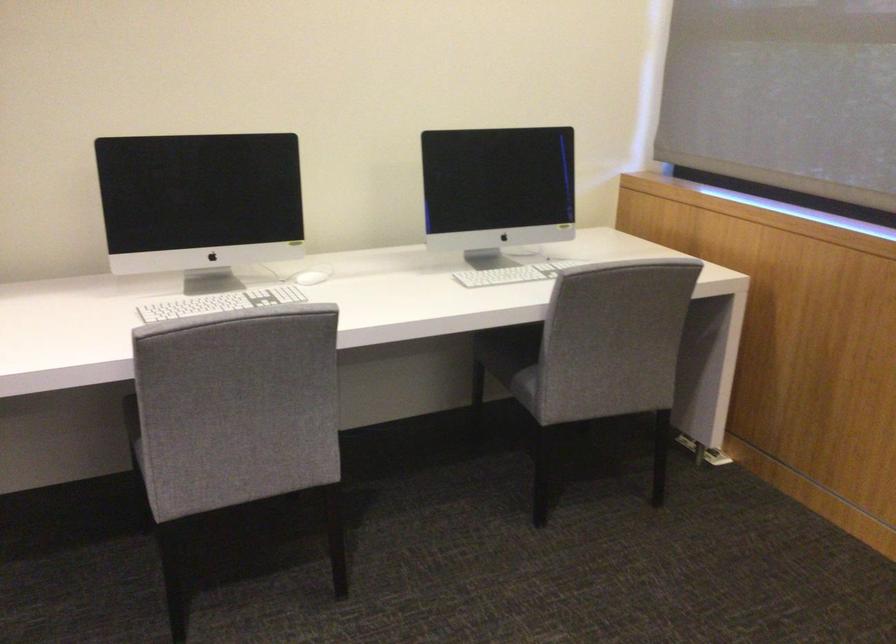
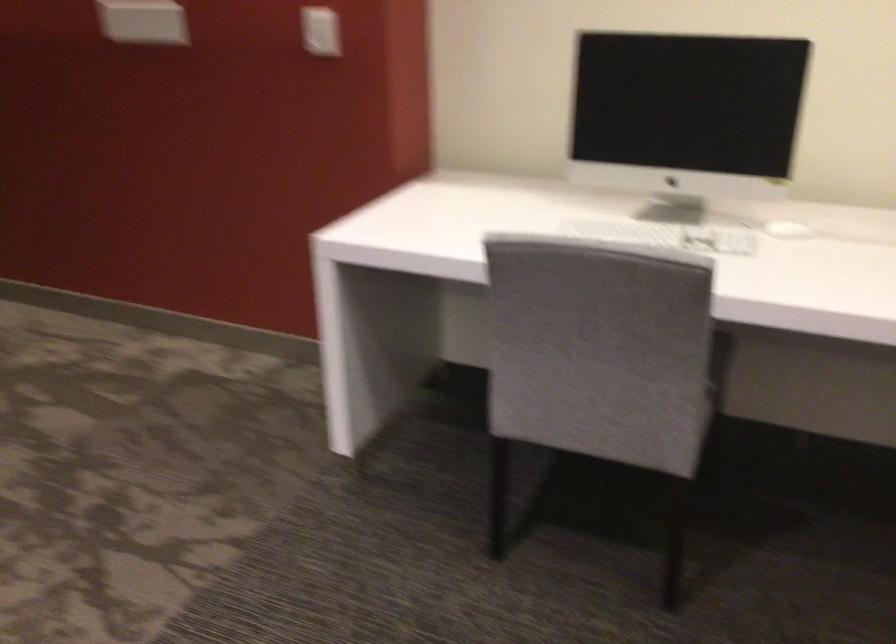
Find the pixel in the second image that matches point 229,304 in the first image.

(666, 234)